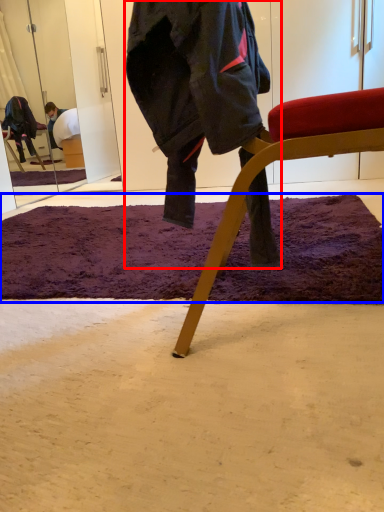
Question: Which point is closer to the camera, person (highlighted by a red box) or mat (highlighted by a blue box)?

Choices:
 (A) person
 (B) mat

Answer: (A)